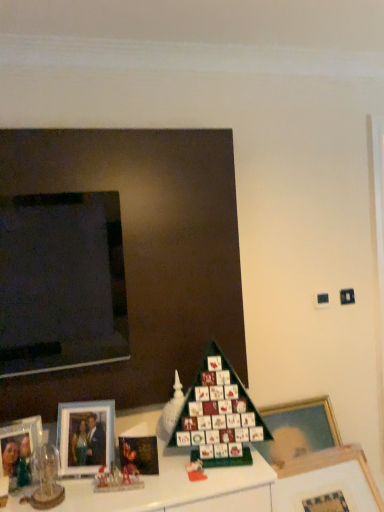
Question: Does wooden picture frame at lower right, the first picture frame in the right-to-left sequence, turn towards matte silver picture frame at lower left, the second picture frame when ordered from left to right?

Choices:
 (A) yes
 (B) no

Answer: (B)

Question: Can you confirm if wooden picture frame at lower right, the first picture frame in the right-to-left sequence, is bigger than matte silver picture frame at lower left, the third picture frame positioned from the right?

Choices:
 (A) no
 (B) yes

Answer: (B)

Question: Does wooden picture frame at lower right, the first picture frame in the right-to-left sequence, lie behind matte silver picture frame at lower left, the second picture frame when ordered from left to right?

Choices:
 (A) no
 (B) yes

Answer: (A)

Question: From the image's perspective, is wooden picture frame at lower right, which ranks as the 4th picture frame in left-to-right order, above matte silver picture frame at lower left, the third picture frame positioned from the right?

Choices:
 (A) no
 (B) yes

Answer: (A)

Question: Can you confirm if wooden picture frame at lower right, which ranks as the 4th picture frame in left-to-right order, is thinner than matte silver picture frame at lower left, the third picture frame positioned from the right?

Choices:
 (A) yes
 (B) no

Answer: (B)

Question: Could matte silver picture frame at lower left, the second picture frame when ordered from left to right, be considered to be inside wooden picture frame at lower right, which ranks as the 4th picture frame in left-to-right order?

Choices:
 (A) yes
 (B) no

Answer: (B)

Question: From the image's perspective, is matte black picture frame at lower left, placed as the 3th picture frame when sorted from left to right, located beneath wooden photo frame at lower left?

Choices:
 (A) no
 (B) yes

Answer: (A)

Question: Does matte black picture frame at lower left, acting as the 2th picture frame starting from the right, come in front of wooden photo frame at lower left?

Choices:
 (A) yes
 (B) no

Answer: (B)

Question: Can you confirm if matte black picture frame at lower left, acting as the 2th picture frame starting from the right, is bigger than wooden photo frame at lower left?

Choices:
 (A) yes
 (B) no

Answer: (B)

Question: Is matte black picture frame at lower left, placed as the 3th picture frame when sorted from left to right, smaller than wooden photo frame at lower left?

Choices:
 (A) yes
 (B) no

Answer: (A)

Question: Is matte black picture frame at lower left, placed as the 3th picture frame when sorted from left to right, at the left side of wooden photo frame at lower left?

Choices:
 (A) no
 (B) yes

Answer: (A)

Question: Can you confirm if matte black picture frame at lower left, placed as the 3th picture frame when sorted from left to right, is thinner than wooden photo frame at lower left?

Choices:
 (A) yes
 (B) no

Answer: (A)

Question: Can you confirm if matte plastic toy at lower center is taller than clear glass photo frame at lower left, which is the fourth picture frame from right to left?

Choices:
 (A) no
 (B) yes

Answer: (A)